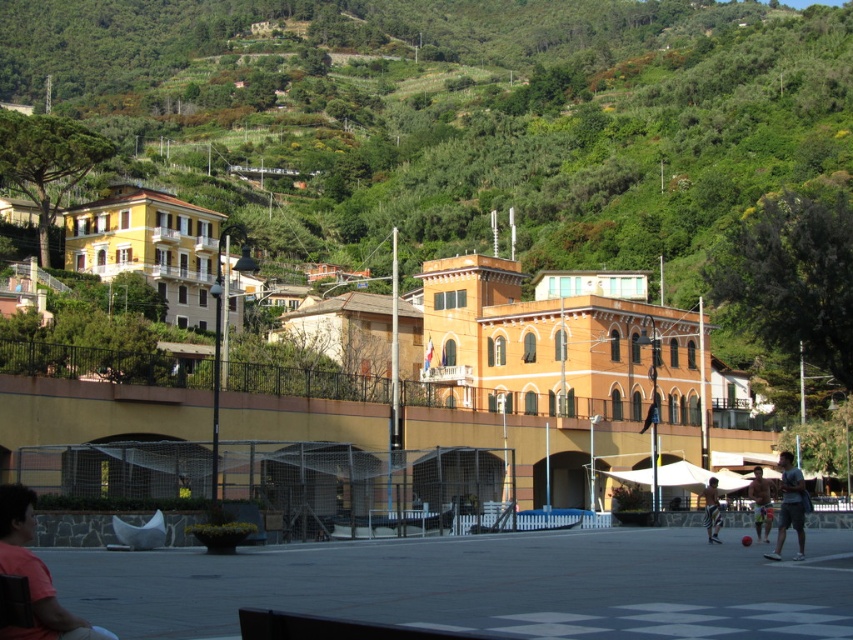
Between point (41, 588) and point (706, 515), which one is positioned behind?

The point (706, 515) is behind.

Does point (50, 605) come farther from viewer compared to point (715, 538)?

No, (50, 605) is closer to viewer.

Where is `matte pink shirt at lower left`? The height and width of the screenshot is (640, 853). matte pink shirt at lower left is located at coordinates (33, 573).

Which is in front, point (756, 536) or point (717, 508)?

Point (756, 536) is in front.

Who is positioned more to the right, tan skin man at center or striped shorts at lower right?

From the viewer's perspective, tan skin man at center appears more on the right side.

Is point (757, 528) in front of point (709, 508)?

Yes, it is.

The width and height of the screenshot is (853, 640). Find the location of `tan skin man at center`. tan skin man at center is located at coordinates (759, 502).

How far apart are matte pink shirt at lower left and dark gray fabric shorts at lower right?

A distance of 90.86 feet exists between matte pink shirt at lower left and dark gray fabric shorts at lower right.

Based on the photo, does matte pink shirt at lower left have a smaller size compared to dark gray fabric shorts at lower right?

Yes.

The width and height of the screenshot is (853, 640). Identify the location of matte pink shirt at lower left. (33, 573).

Locate an element on the screen. This screenshot has width=853, height=640. matte pink shirt at lower left is located at coordinates (33, 573).